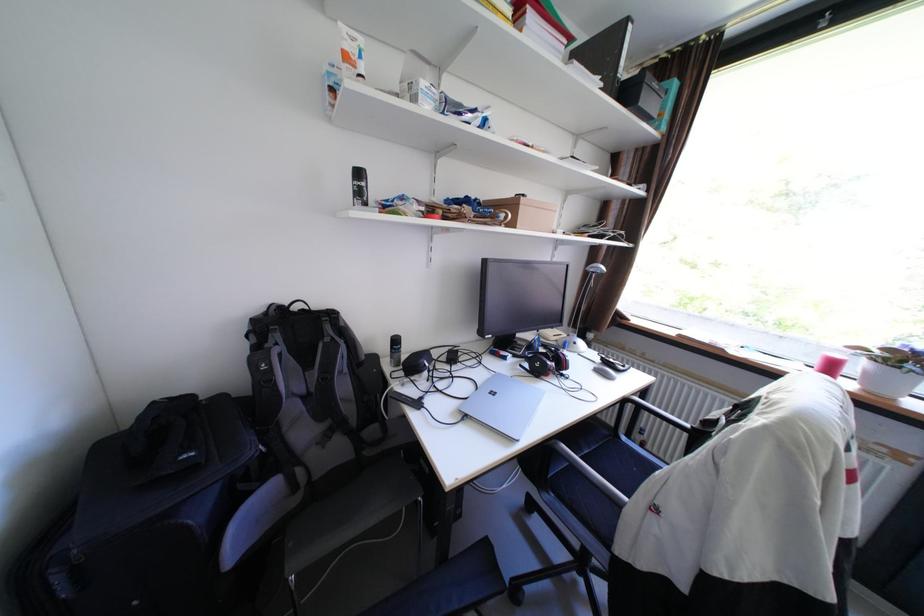
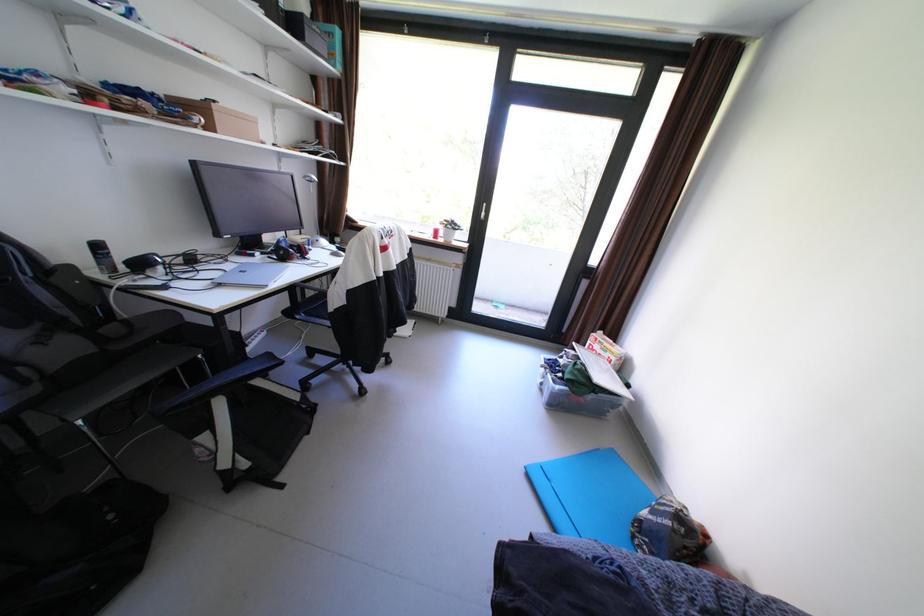
Where in the second image is the point corresponding to (x=403, y=347) from the first image?

(106, 254)